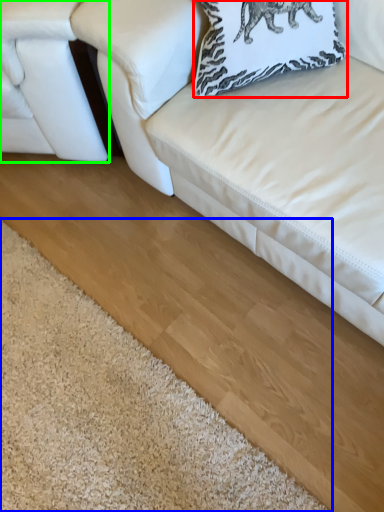
Question: Which object is positioned closest to pillow (highlighted by a red box)? Select from mat (highlighted by a blue box) and studio couch (highlighted by a green box).

Choices:
 (A) mat
 (B) studio couch

Answer: (B)